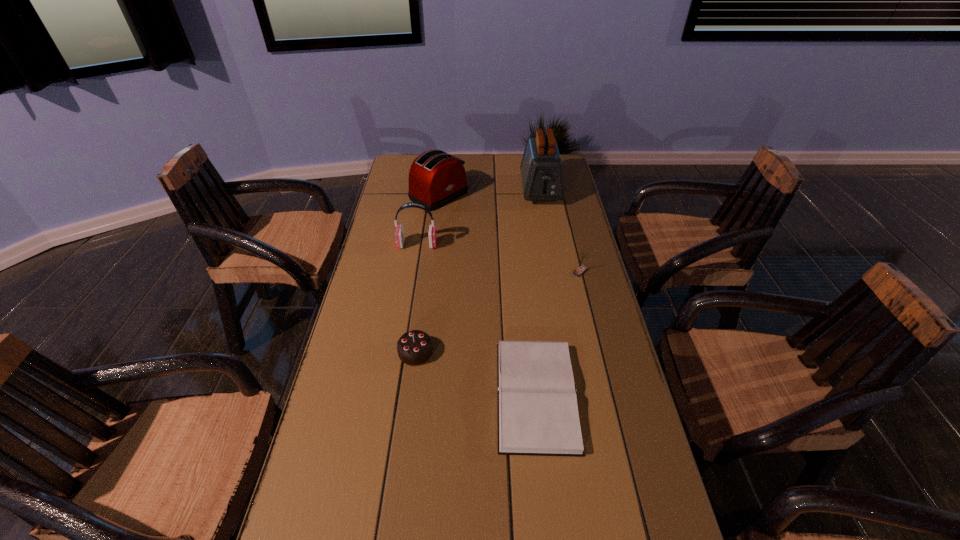
Where is `vacant area located on the outer surface of the third farthest object`? vacant area located on the outer surface of the third farthest object is located at coordinates (510, 245).

You are a GUI agent. You are given a task and a screenshot of the screen. Output one action in this format:
    pyautogui.click(x=<x>, y=<y>)
    Task: Click on the free point located 0.280m on the back of the matchbox
    The image size is (960, 540).
    Given the screenshot: What is the action you would take?
    pyautogui.click(x=566, y=217)

The width and height of the screenshot is (960, 540). What are the coordinates of `vacant space situated on the front of the second shortest object` in the screenshot? It's located at (391, 537).

Image resolution: width=960 pixels, height=540 pixels. I want to click on vacant area situated 0.350m on the back of the shortest object, so click(522, 261).

You are a GUI agent. You are given a task and a screenshot of the screen. Output one action in this format:
    pyautogui.click(x=<x>, y=<y>)
    Task: Click on the toaster at the left edge
    This screenshot has height=540, width=960.
    Given the screenshot: What is the action you would take?
    pyautogui.click(x=436, y=178)

Locate an element on the screen. earphone that is at the left edge is located at coordinates (399, 232).

In order to click on chocolate cake at the left edge in this screenshot , I will do `click(414, 348)`.

Identify the location of toaster positioned at the right edge. (541, 167).

In order to click on matchbox located at the right edge in this screenshot , I will do pyautogui.click(x=581, y=269).

You are a GUI agent. You are given a task and a screenshot of the screen. Output one action in this format:
    pyautogui.click(x=<x>, y=<y>)
    Task: Click on the hardback book that is at the right edge
    This screenshot has width=960, height=540.
    Given the screenshot: What is the action you would take?
    click(x=538, y=414)